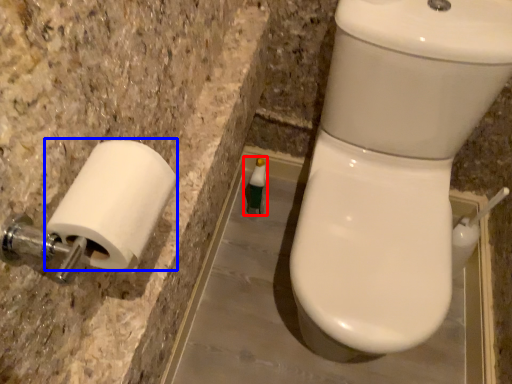
Question: Among these objects, which one is nearest to the camera, toiletry (highlighted by a red box) or toilet paper (highlighted by a blue box)?

Choices:
 (A) toiletry
 (B) toilet paper

Answer: (B)